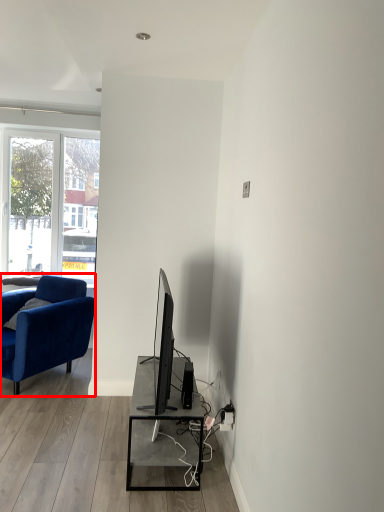
Question: From the image, what is the correct spatial relationship of chair (annotated by the red box) in relation to speaker?

Choices:
 (A) right
 (B) left

Answer: (B)